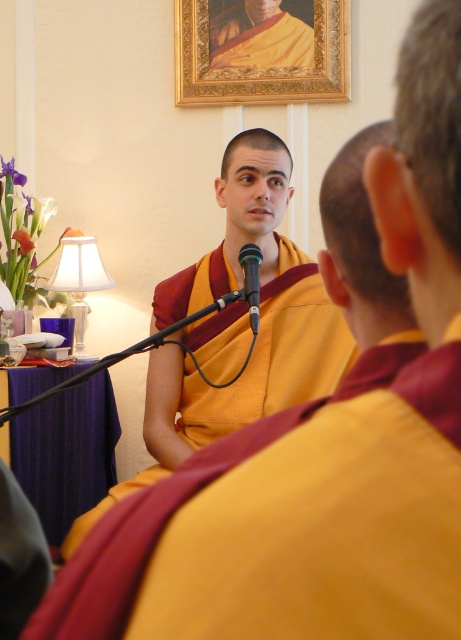
You are attending a meeting and need to adjust the microphone so it faces the speaker. The goldframed picture at upper center and the black plastic microphone at center are in your view. Which object is to the right of the microphone?

The goldframed picture at upper center is positioned on the right side of the black plastic microphone at center, so it is to the right of the microphone.

You are an interior designer planning to add a new light fixture. You need to know the spatial relationship between the matte yellow and maroon robe at center and the goldframed picture at upper center. Which object is positioned higher in the image?

The goldframed picture at upper center is positioned higher than the matte yellow and maroon robe at center.